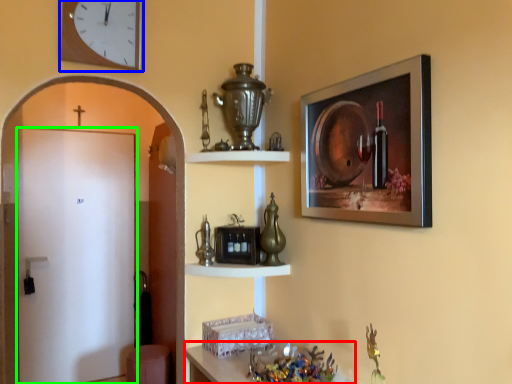
Question: Which object is the closest to the table (highlighted by a red box)? Choose among these: clock (highlighted by a blue box) or door (highlighted by a green box).

Choices:
 (A) clock
 (B) door

Answer: (A)